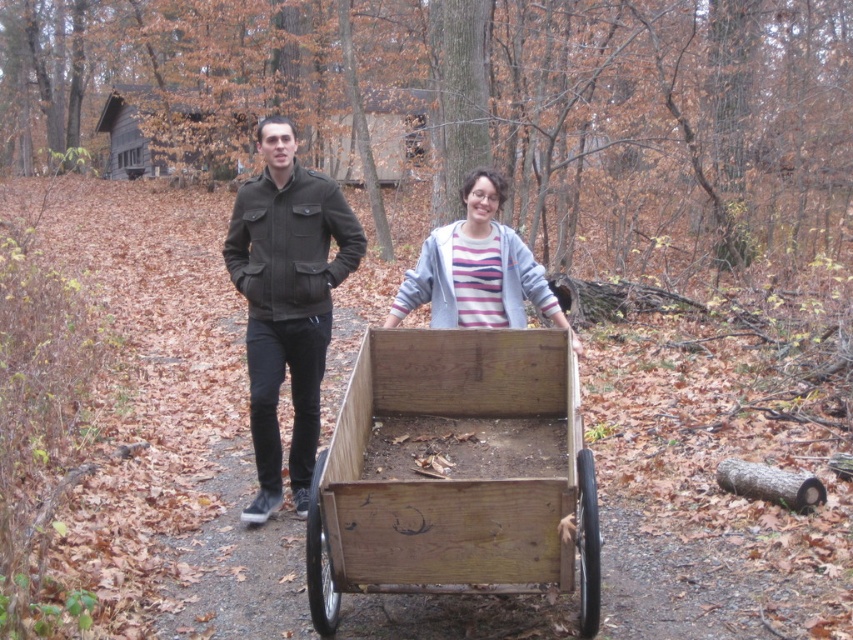
You are standing at the point labeled as point [456,474] in the image. What object are you currently standing on?

You are standing on the wooden wagon at center.